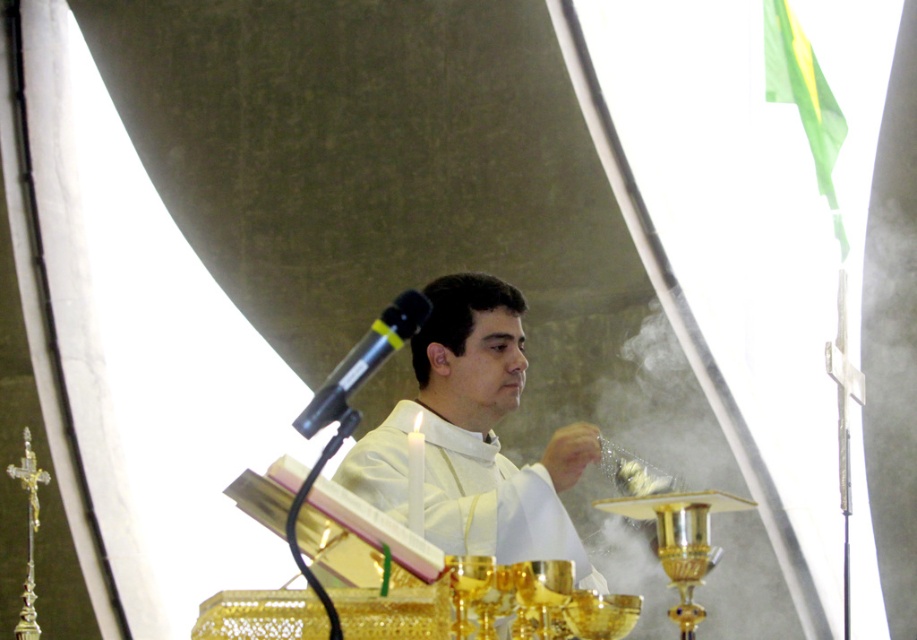
You are standing at the point closest to the priest in the religious setting. Which point, point (551,452) or point (389,344), is farther away from you?

Point (551,452) is farther away from you because it is behind point (389,344), which is closer to the priest.